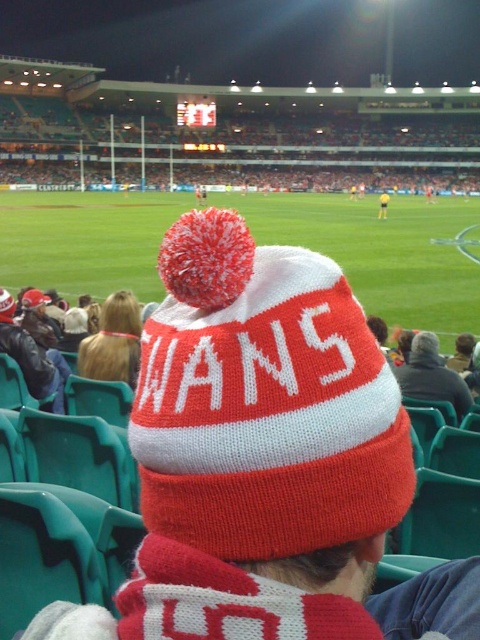
You are a photographer standing at the center of the stadium, and you want to take a photo of both the person in the foreground and the players on the field. Which of the two points, point [210,234] or point [17,330], is closer to your camera?

Point [210,234] is closer to the camera than point [17,330].

You are a photographer at the stadium and want to capture a photo of the two subjects in the center of the image, the blonde hair at center and the yellow jersey at center. Which one is shorter?

The blonde hair at center is shorter than the yellow jersey at center.

You are a photographer at the stadium and want to capture a photo where the knitted woolen hat at center and the green grass football field at center are both clearly visible. Based on their positions, which object is closer to the camera?

The knitted woolen hat at center is closer to the camera because it is positioned below the green grass football field at center, indicating it is in the foreground.